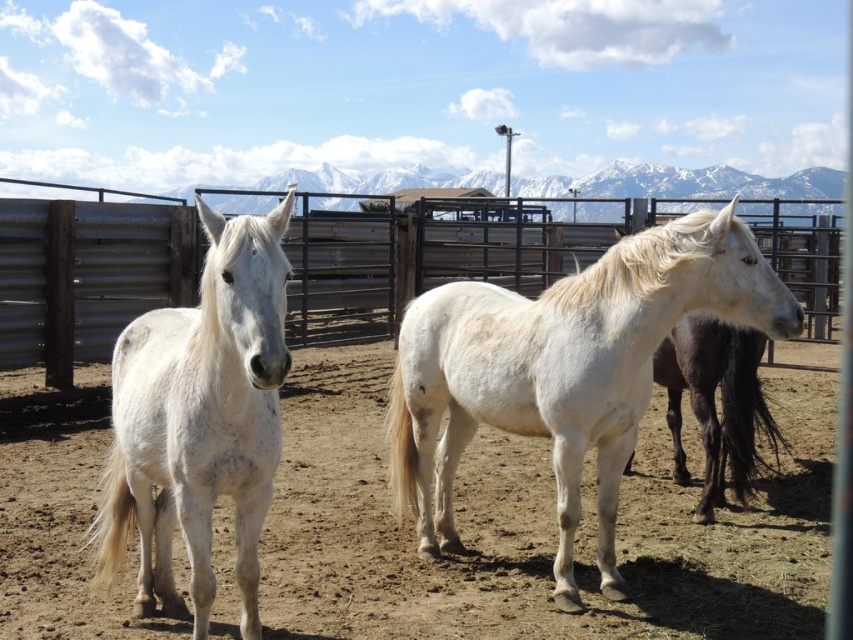
Question: Does dirt field at center appear on the left side of metallic corrugated fence at center?

Choices:
 (A) no
 (B) yes

Answer: (B)

Question: Estimate the real-world distances between objects in this image. Which object is closer to the dirt field at center?

Choices:
 (A) white matte horse at left
 (B) metallic corrugated fence at center
 (C) white matte horse at center

Answer: (C)

Question: Is dirt field at center further to the viewer compared to white matte horse at center?

Choices:
 (A) yes
 (B) no

Answer: (A)

Question: Estimate the real-world distances between objects in this image. Which object is closer to the white matte horse at center?

Choices:
 (A) white matte horse at left
 (B) dirt field at center

Answer: (B)

Question: Can you confirm if white matte horse at center is wider than metallic corrugated fence at center?

Choices:
 (A) no
 (B) yes

Answer: (A)

Question: Which of these objects is positioned farthest from the white matte horse at center?

Choices:
 (A) dirt field at center
 (B) metallic corrugated fence at center
 (C) white matte horse at left

Answer: (B)